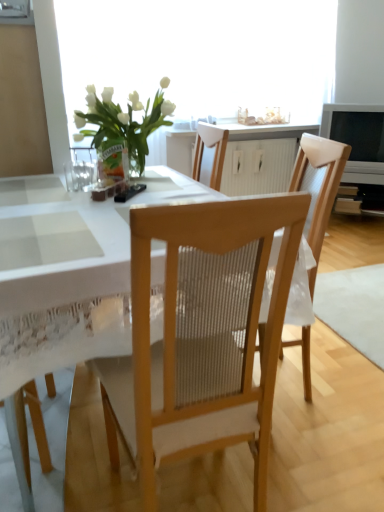
Where is `free location to the right of wooden chair at center, the 1th chair viewed from the front`? free location to the right of wooden chair at center, the 1th chair viewed from the front is located at coordinates (311, 464).